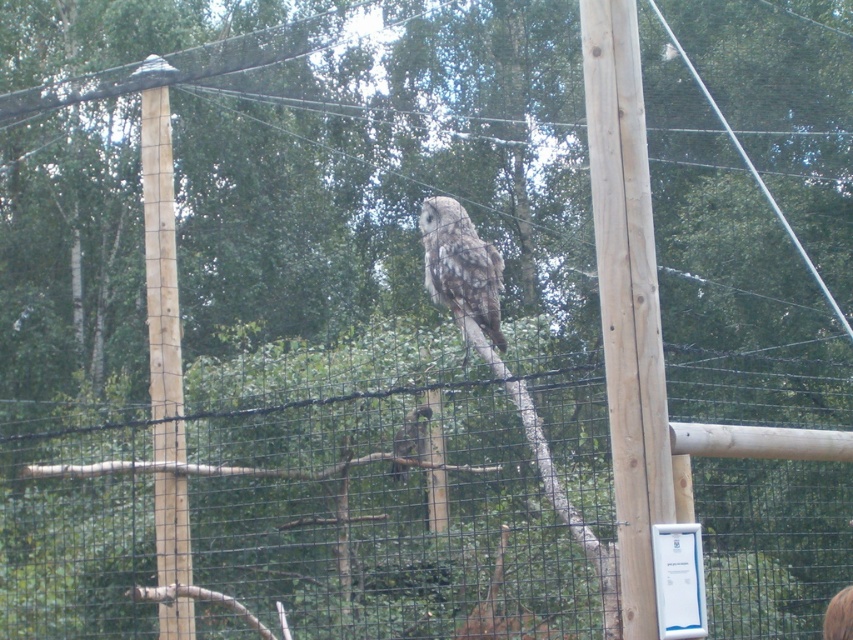
Between natural wood telegraph pole at left and brown speckled owl at center, which one appears on the right side from the viewer's perspective?

brown speckled owl at center

Who is more forward, (x=169, y=145) or (x=393, y=449)?

Point (x=393, y=449) is in front.

Locate an element on the screen. The image size is (853, 640). natural wood telegraph pole at left is located at coordinates (160, 260).

Is black mesh fence at center bigger than brown speckled owl at center?

Indeed, black mesh fence at center has a larger size compared to brown speckled owl at center.

Does point (495, 428) come behind point (403, 420)?

No, it is in front of (403, 420).

Where is `black mesh fence at center`? black mesh fence at center is located at coordinates (329, 500).

Does natural wood telegraph pole at center come in front of speckled gray owl at center?

That is True.

Is natural wood telegraph pole at center wider than speckled gray owl at center?

No.

The height and width of the screenshot is (640, 853). What are the coordinates of `natural wood telegraph pole at center` in the screenshot? It's located at pyautogui.click(x=627, y=300).

This screenshot has width=853, height=640. In order to click on natural wood telegraph pole at center in this screenshot , I will do `click(627, 300)`.